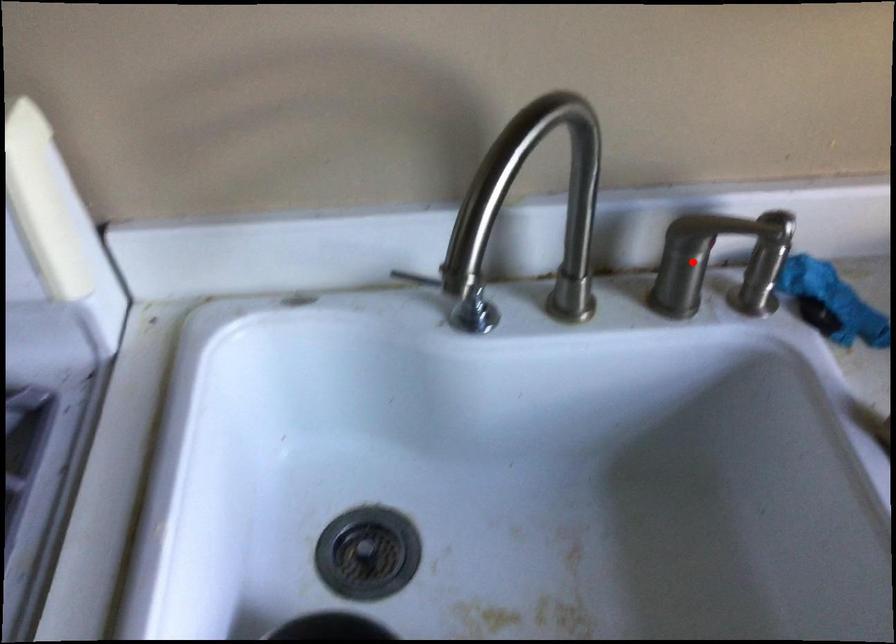
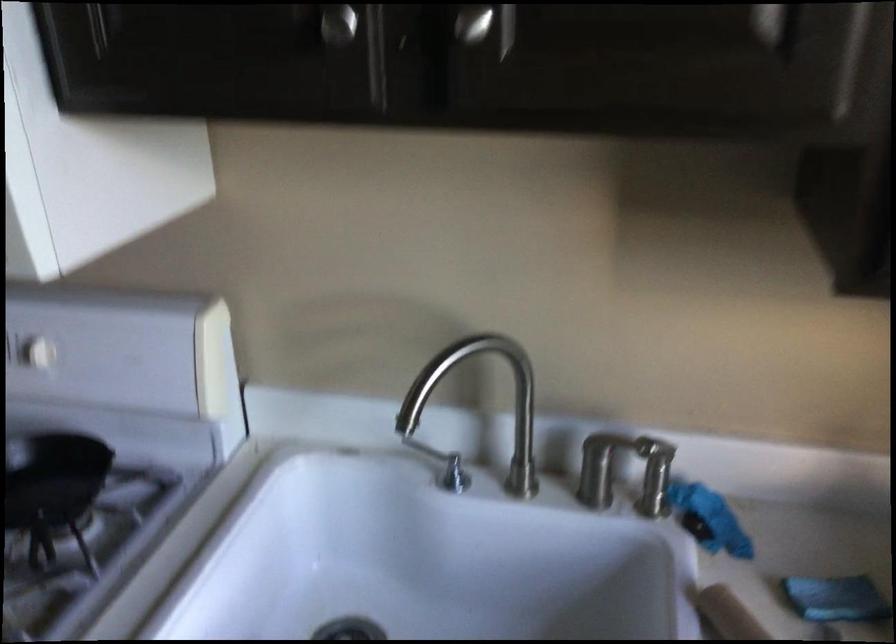
Question: I am providing you with two images of the same scene from different viewpoints. A red point is shown in image1. For the corresponding object point in image2, is it positioned nearer or farther from the camera?

Choices:
 (A) Nearer
 (B) Farther

Answer: (B)